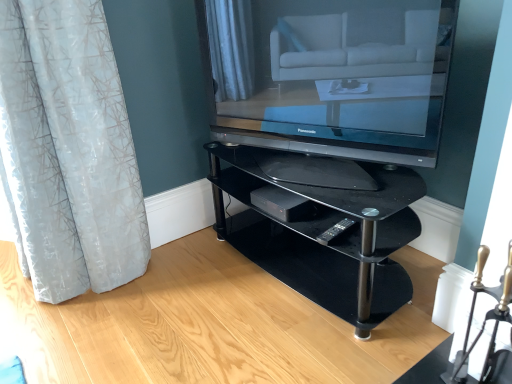
Question: Considering the relative sizes of matte black television at center and black glass shelf at center in the image provided, is matte black television at center taller than black glass shelf at center?

Choices:
 (A) yes
 (B) no

Answer: (A)

Question: Could you tell me if matte black television at center is turned towards black glass shelf at center?

Choices:
 (A) no
 (B) yes

Answer: (A)

Question: Is matte black television at center next to black glass shelf at center?

Choices:
 (A) yes
 (B) no

Answer: (B)

Question: Is matte black television at center positioned behind black glass shelf at center?

Choices:
 (A) no
 (B) yes

Answer: (A)

Question: From a real-world perspective, is matte black television at center located higher than black glass shelf at center?

Choices:
 (A) yes
 (B) no

Answer: (A)

Question: In terms of width, does black plastic remote at lower center look wider or thinner when compared to matte black television at center?

Choices:
 (A) thin
 (B) wide

Answer: (A)

Question: Is black plastic remote at lower center inside the boundaries of matte black television at center, or outside?

Choices:
 (A) outside
 (B) inside

Answer: (A)

Question: Visually, is black plastic remote at lower center positioned to the left or to the right of matte black television at center?

Choices:
 (A) left
 (B) right

Answer: (B)

Question: Looking at the image, does black plastic remote at lower center seem bigger or smaller compared to matte black television at center?

Choices:
 (A) big
 (B) small

Answer: (B)

Question: Does point (331, 79) appear closer or farther from the camera than point (351, 218)?

Choices:
 (A) closer
 (B) farther

Answer: (A)

Question: Relative to black plastic remote at lower center, is matte black television at center in front or behind?

Choices:
 (A) front
 (B) behind

Answer: (A)

Question: In terms of width, does matte black television at center look wider or thinner when compared to black plastic remote at lower center?

Choices:
 (A) thin
 (B) wide

Answer: (B)

Question: Would you say matte black television at center is to the left or to the right of black plastic remote at lower center in the picture?

Choices:
 (A) right
 (B) left

Answer: (B)

Question: In the image, is translucent white curtain at left positioned in front of or behind matte black television at center?

Choices:
 (A) front
 (B) behind

Answer: (B)

Question: From the image's perspective, relative to matte black television at center, is translucent white curtain at left above or below?

Choices:
 (A) above
 (B) below

Answer: (B)